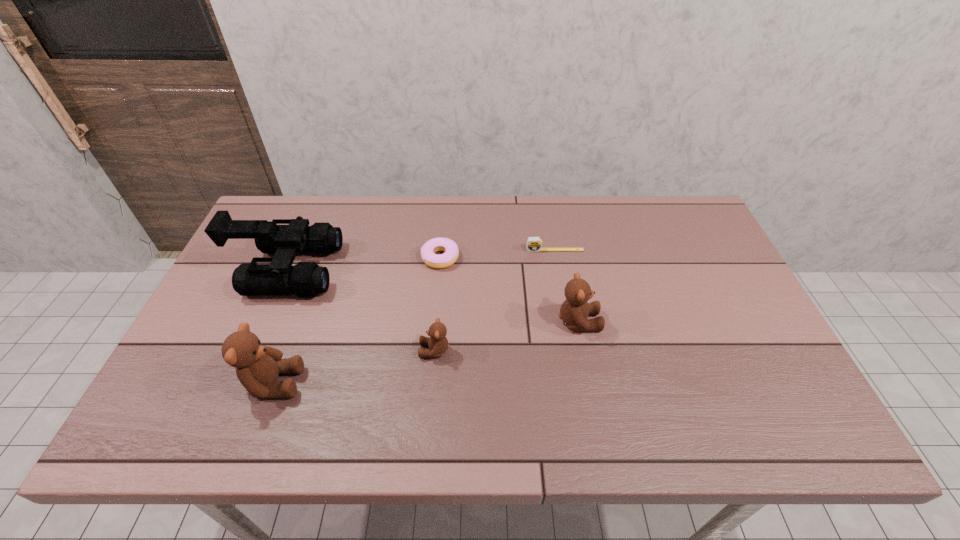
The image size is (960, 540). What are the coordinates of `free point between the tape measure and the leftmost teddy bear` in the screenshot? It's located at (414, 316).

At what (x,y) coordinates should I click in order to perform the action: click on vacant area that lies between the doughnut and the binoculars. Please return your answer as a coordinate pair (x, y). Image resolution: width=960 pixels, height=540 pixels. Looking at the image, I should click on tap(363, 264).

The height and width of the screenshot is (540, 960). In order to click on object identified as the third closest to the tape measure in this screenshot , I will do `click(438, 344)`.

Where is `the third closest object to the doughnut`? the third closest object to the doughnut is located at coordinates (306, 279).

You are a GUI agent. You are given a task and a screenshot of the screen. Output one action in this format:
    pyautogui.click(x=<x>, y=<y>)
    Task: Click on the teddy bear identified as the second closest to the binoculars
    
    Given the screenshot: What is the action you would take?
    pyautogui.click(x=438, y=344)

Find the location of a particular element. The width and height of the screenshot is (960, 540). the closest teddy bear to the doughnut is located at coordinates (438, 344).

Where is `vacant space that satisfies the following two spatial constraints: 1. at the front of the tape measure with the tape extended; 2. on the face of the leftmost teddy bear`? The image size is (960, 540). vacant space that satisfies the following two spatial constraints: 1. at the front of the tape measure with the tape extended; 2. on the face of the leftmost teddy bear is located at coordinates (578, 383).

Where is `vacant region that satisfies the following two spatial constraints: 1. at the front of the tape measure with the tape extended; 2. on the face of the shortest teddy bear`? The image size is (960, 540). vacant region that satisfies the following two spatial constraints: 1. at the front of the tape measure with the tape extended; 2. on the face of the shortest teddy bear is located at coordinates (572, 350).

Where is `free region that satisfies the following two spatial constraints: 1. at the front of the tape measure with the tape extended; 2. on the face of the third shortest object`? This screenshot has width=960, height=540. free region that satisfies the following two spatial constraints: 1. at the front of the tape measure with the tape extended; 2. on the face of the third shortest object is located at coordinates (572, 350).